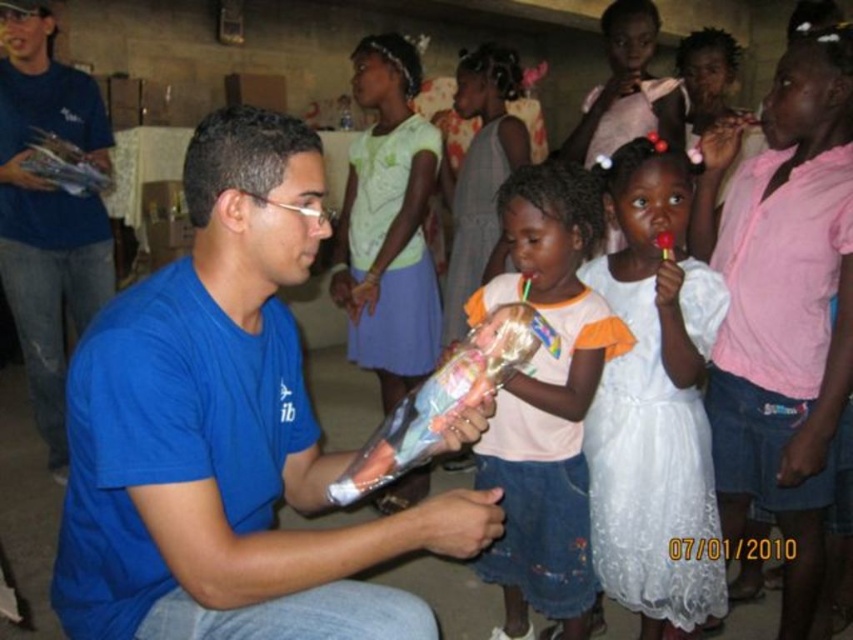
Question: In this image, where is white lace dress at center located relative to blue t-shirt at left?

Choices:
 (A) above
 (B) below

Answer: (B)

Question: Which of the following is the closest to the observer?

Choices:
 (A) pink cotton dress at center
 (B) blue t-shirt at left
 (C) white lace dress at center

Answer: (C)

Question: Which of the following is the farthest from the observer?

Choices:
 (A) blue t-shirt at left
 (B) blue cotton shirt at center

Answer: (A)

Question: Which of the following is the closest to the observer?

Choices:
 (A) pink cotton dress at center
 (B) blue cotton shirt at center

Answer: (B)

Question: Is blue cotton shirt at center to the left of pink cotton dress at center from the viewer's perspective?

Choices:
 (A) no
 (B) yes

Answer: (B)

Question: Does blue cotton shirt at center appear under pink cotton dress at center?

Choices:
 (A) no
 (B) yes

Answer: (A)